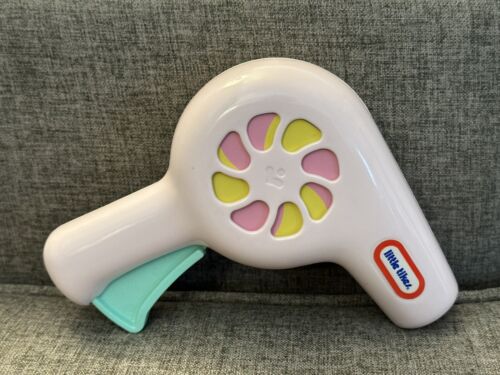
I want to click on gray couch cushion, so click(250, 337).